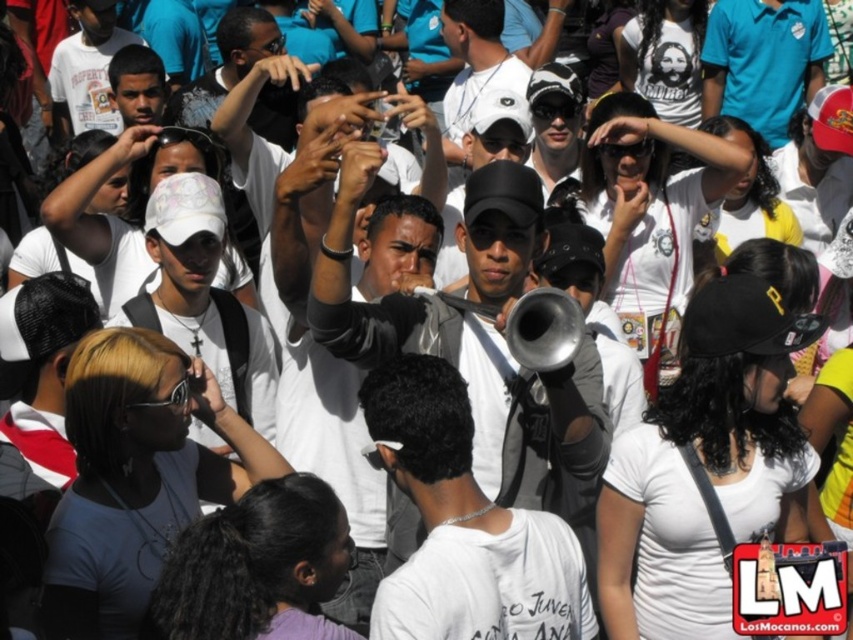
Question: Which point is closer to the camera?

Choices:
 (A) white matte cap at center
 (B) metallic megaphone at center
 (C) white t-shirt at center
 (D) matte black cap at upper center

Answer: (B)

Question: Which of these objects is positioned closest to the silver metallic trumpet at center?

Choices:
 (A) shiny silver trumpet at center
 (B) metallic silver megaphone at center

Answer: (A)

Question: Does metallic megaphone at center appear on the right side of shiny silver trumpet at center?

Choices:
 (A) no
 (B) yes

Answer: (A)

Question: Which of the following is the closest to the observer?

Choices:
 (A) (519, 326)
 (B) (273, 129)

Answer: (A)

Question: Is white t-shirt at center closer to camera compared to shiny silver trumpet at center?

Choices:
 (A) yes
 (B) no

Answer: (B)

Question: Does white t-shirt at center have a lesser width compared to black plastic goggles at lower left?

Choices:
 (A) no
 (B) yes

Answer: (B)